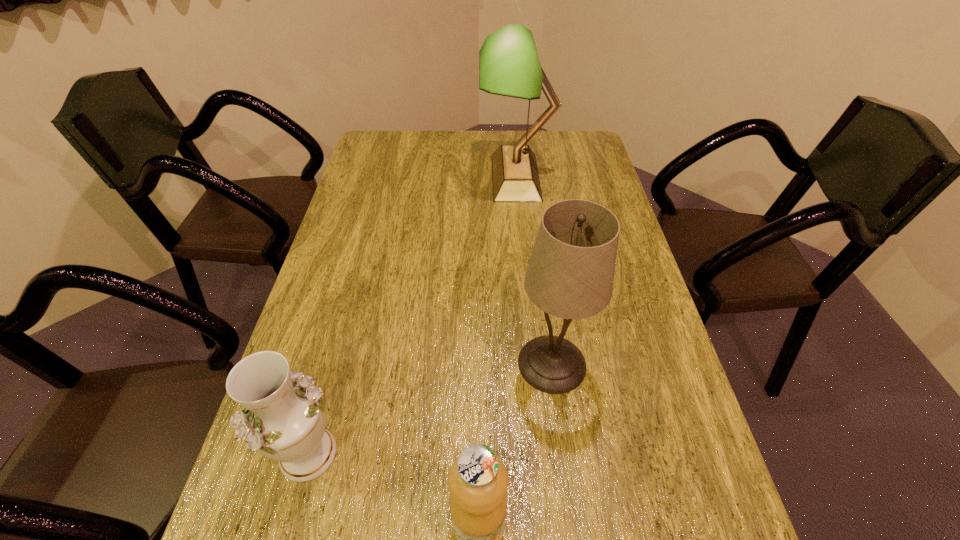
The height and width of the screenshot is (540, 960). In order to click on vacant point located 0.240m on the right of the vase in this screenshot , I will do pos(467,454).

Image resolution: width=960 pixels, height=540 pixels. I want to click on object that is at the far edge, so click(x=509, y=65).

This screenshot has height=540, width=960. Identify the location of object located in the left edge section of the desktop. (284, 419).

The image size is (960, 540). In the image, there is a desktop. What are the coordinates of `free space at the far edge` in the screenshot? It's located at (435, 144).

Find the location of `vacant area at the left edge`. vacant area at the left edge is located at coordinates (364, 258).

You are a GUI agent. You are given a task and a screenshot of the screen. Output one action in this format:
    pyautogui.click(x=<x>, y=<y>)
    Task: Click on the vacant space at the right edge
    
    Given the screenshot: What is the action you would take?
    pyautogui.click(x=643, y=306)

The image size is (960, 540). Find the location of `vacant point at the far right corner`. vacant point at the far right corner is located at coordinates (558, 142).

I want to click on empty space between the vase and the farthest object, so click(x=412, y=315).

Identify the location of free point between the farthest object and the third farthest object. (412, 315).

Locate which object ranks third in proximity to the table lamp. Please provide its 2D coordinates. Your answer should be formatted as a tuple, i.e. [(x, y)], where the tuple contains the x and y coordinates of a point satisfying the conditions above.

[(478, 481)]